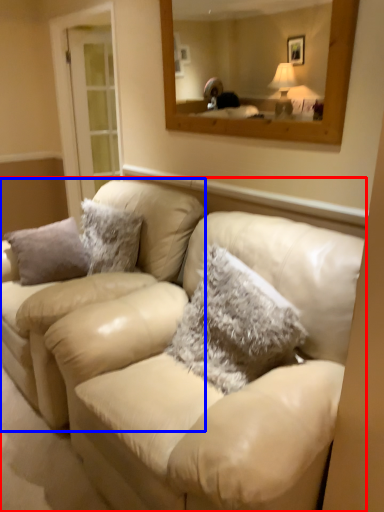
Question: Which point is closer to the camera, studio couch (highlighted by a red box) or couch (highlighted by a blue box)?

Choices:
 (A) studio couch
 (B) couch

Answer: (A)